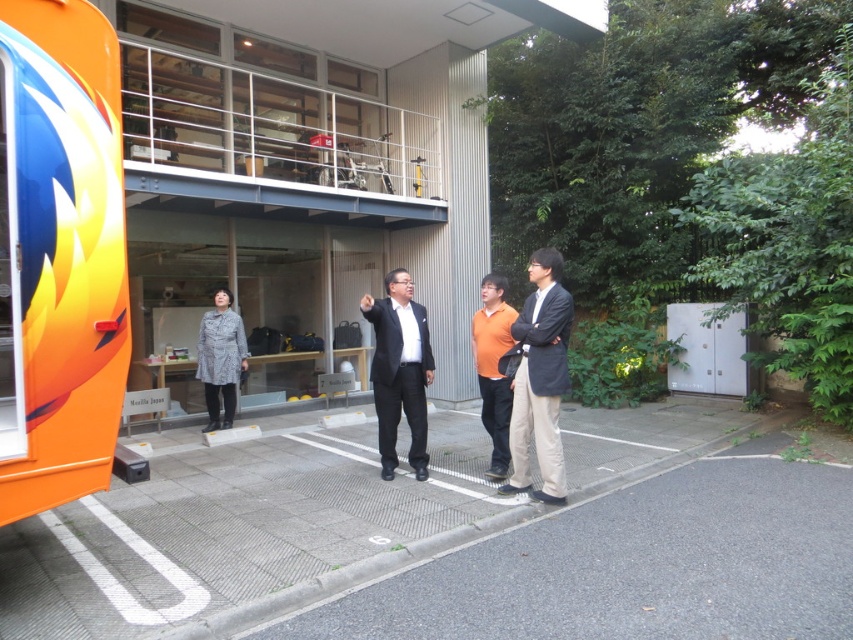
Does orange glossy tour bus at left have a greater width compared to black suit at center?

Yes, orange glossy tour bus at left is wider than black suit at center.

Does orange glossy tour bus at left appear on the left side of black suit at center?

Correct, you'll find orange glossy tour bus at left to the left of black suit at center.

Is point (68, 500) less distant than point (390, 342)?

Yes, point (68, 500) is in front of point (390, 342).

Locate an element on the screen. orange glossy tour bus at left is located at coordinates (61, 252).

Is the position of orange glossy tour bus at left less distant than that of orange matte shirt at center?

Yes, it is.

Does orange glossy tour bus at left appear over orange matte shirt at center?

Indeed, orange glossy tour bus at left is positioned over orange matte shirt at center.

Who is more distant from viewer, (x=85, y=52) or (x=508, y=428)?

Point (x=508, y=428)

Identify the location of orange glossy tour bus at left. (61, 252).

Can you confirm if orange glossy tour bus at left is shorter than patterned fabric coat at lower left?

Incorrect, orange glossy tour bus at left's height does not fall short of patterned fabric coat at lower left's.

Does orange glossy tour bus at left have a smaller size compared to patterned fabric coat at lower left?

No.

Does point (86, 99) lie behind point (212, 412)?

No, (86, 99) is in front of (212, 412).

Find the location of a particular element. The image size is (853, 640). orange glossy tour bus at left is located at coordinates (61, 252).